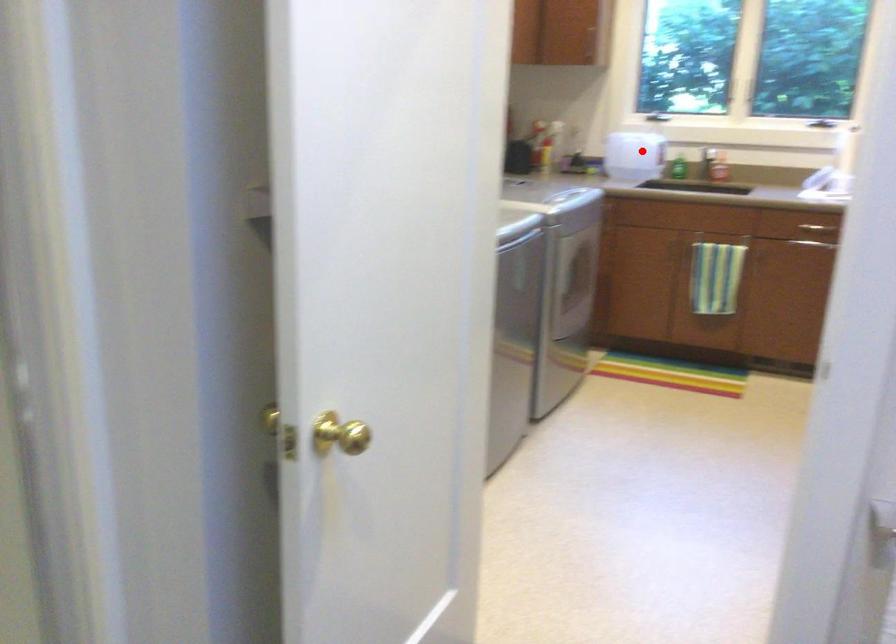
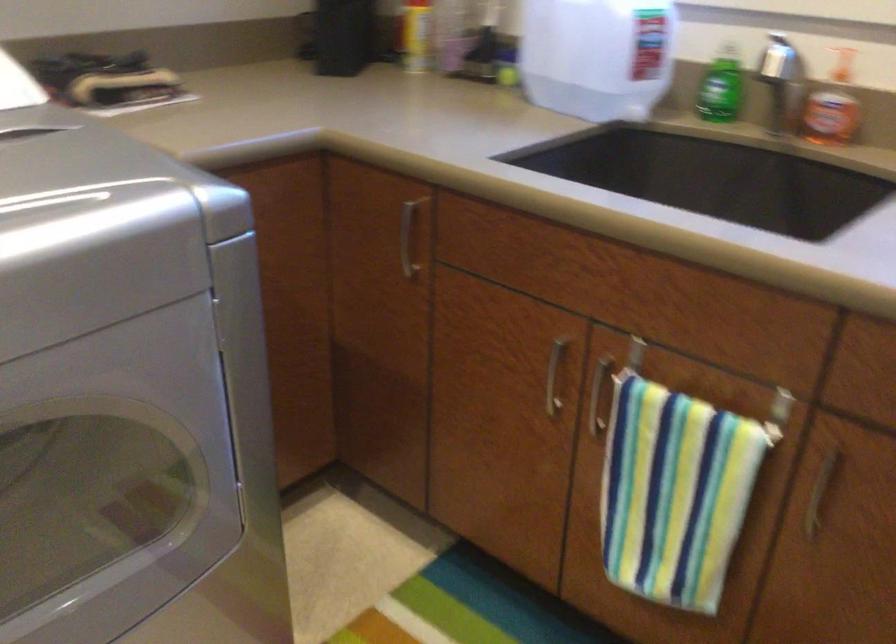
In the second image, find the point that corresponds to the highlighted location in the first image.

(597, 55)